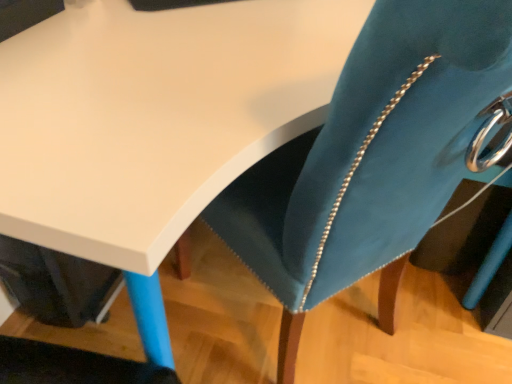
Question: Is the depth of velvet teal swivel chair at center greater than that of matte white table at upper left?

Choices:
 (A) yes
 (B) no

Answer: (B)

Question: From a real-world perspective, is velvet teal swivel chair at center located beneath matte white table at upper left?

Choices:
 (A) yes
 (B) no

Answer: (B)

Question: Is velvet teal swivel chair at center shorter than matte white table at upper left?

Choices:
 (A) yes
 (B) no

Answer: (B)

Question: Is velvet teal swivel chair at center facing towards matte white table at upper left?

Choices:
 (A) no
 (B) yes

Answer: (B)

Question: Can you confirm if velvet teal swivel chair at center is thinner than matte white table at upper left?

Choices:
 (A) yes
 (B) no

Answer: (A)

Question: Would you say velvet teal swivel chair at center is outside matte white table at upper left?

Choices:
 (A) no
 (B) yes

Answer: (A)

Question: From a real-world perspective, is matte white table at upper left physically above velvet teal swivel chair at center?

Choices:
 (A) yes
 (B) no

Answer: (B)

Question: Are matte white table at upper left and velvet teal swivel chair at center far apart?

Choices:
 (A) no
 (B) yes

Answer: (A)

Question: Is matte white table at upper left further to the viewer compared to velvet teal swivel chair at center?

Choices:
 (A) no
 (B) yes

Answer: (B)

Question: Does matte white table at upper left have a greater height compared to velvet teal swivel chair at center?

Choices:
 (A) no
 (B) yes

Answer: (A)

Question: Is matte white table at upper left not within velvet teal swivel chair at center?

Choices:
 (A) yes
 (B) no

Answer: (A)

Question: From the image's perspective, would you say matte white table at upper left is positioned over velvet teal swivel chair at center?

Choices:
 (A) no
 (B) yes

Answer: (B)

Question: Do you think velvet teal swivel chair at center is within matte white table at upper left, or outside of it?

Choices:
 (A) outside
 (B) inside

Answer: (B)